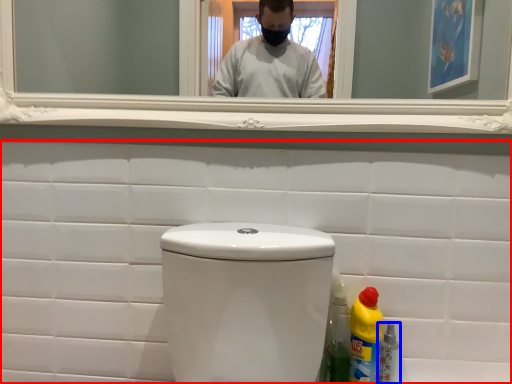
Question: Which point is further to the camera, porcelain (highlighted by a red box) or bottle (highlighted by a blue box)?

Choices:
 (A) porcelain
 (B) bottle

Answer: (B)